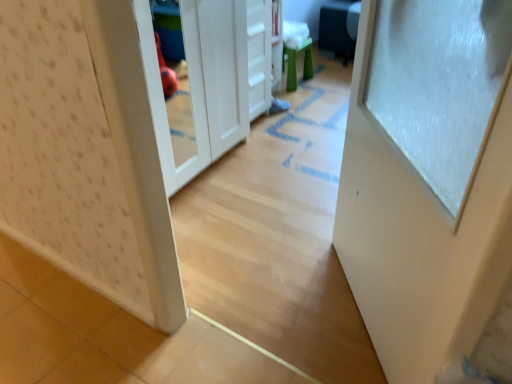
Question: Is white matte drawer at center turned away from green rubber stool at center?

Choices:
 (A) yes
 (B) no

Answer: (B)

Question: Considering the relative sizes of white matte drawer at center and green rubber stool at center in the image provided, is white matte drawer at center wider than green rubber stool at center?

Choices:
 (A) yes
 (B) no

Answer: (B)

Question: Can you confirm if white matte drawer at center is bigger than green rubber stool at center?

Choices:
 (A) yes
 (B) no

Answer: (A)

Question: Is white matte drawer at center taller than green rubber stool at center?

Choices:
 (A) no
 (B) yes

Answer: (B)

Question: Can you confirm if white matte drawer at center is positioned to the right of green rubber stool at center?

Choices:
 (A) yes
 (B) no

Answer: (B)

Question: Is white glossy door at right spatially inside green rubber stool at center, or outside of it?

Choices:
 (A) inside
 (B) outside

Answer: (B)

Question: Is white glossy door at right bigger or smaller than green rubber stool at center?

Choices:
 (A) small
 (B) big

Answer: (B)

Question: Is point (448, 137) positioned closer to the camera than point (292, 76)?

Choices:
 (A) farther
 (B) closer

Answer: (B)

Question: In terms of height, does white glossy door at right look taller or shorter compared to green rubber stool at center?

Choices:
 (A) tall
 (B) short

Answer: (A)

Question: Is point (287, 49) closer or farther from the camera than point (263, 109)?

Choices:
 (A) farther
 (B) closer

Answer: (A)

Question: Do you think green rubber stool at center is within white matte drawer at center, or outside of it?

Choices:
 (A) inside
 (B) outside

Answer: (B)

Question: Considering their positions, is green rubber stool at center located in front of or behind white matte drawer at center?

Choices:
 (A) behind
 (B) front

Answer: (A)

Question: From the image's perspective, is green rubber stool at center above or below white matte drawer at center?

Choices:
 (A) below
 (B) above

Answer: (B)

Question: From a real-world perspective, is white matte drawer at center above or below green rubber stool at center?

Choices:
 (A) above
 (B) below

Answer: (A)

Question: In the image, is white matte drawer at center positioned in front of or behind green rubber stool at center?

Choices:
 (A) front
 (B) behind

Answer: (A)